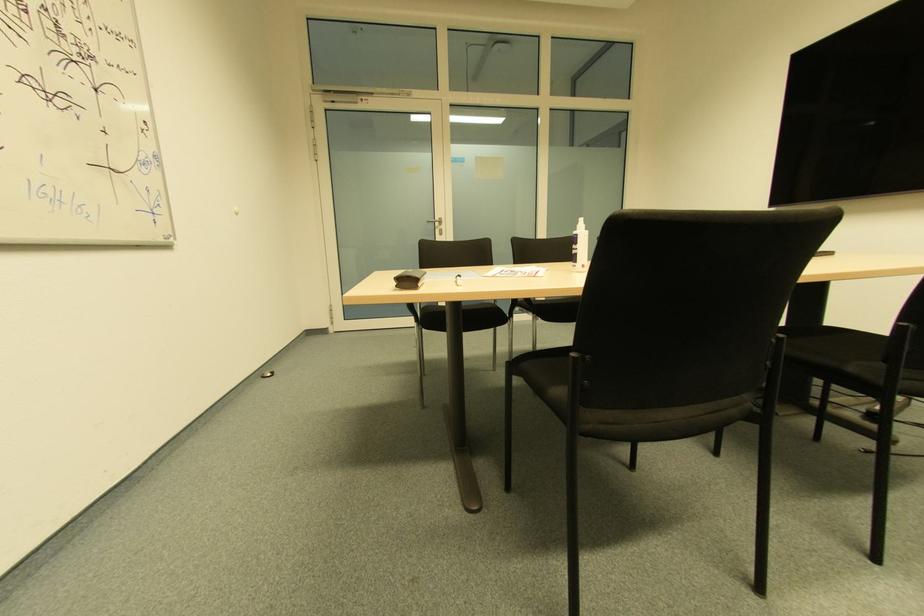
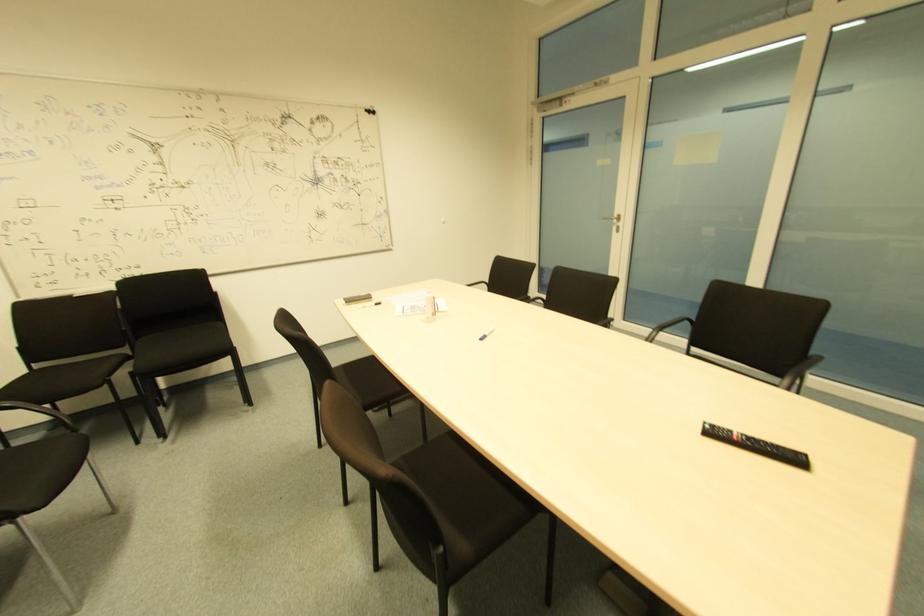
In the second image, find the point that corresponds to pixel 440 230 in the first image.

(618, 227)